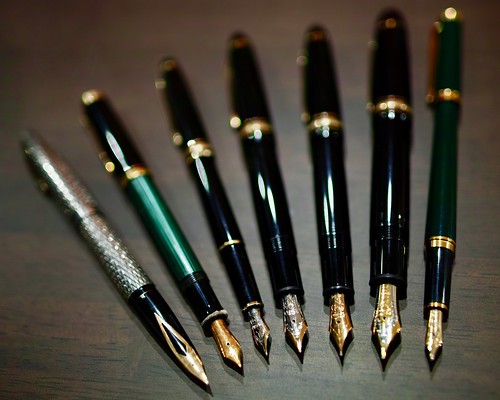
Find the location of a particular element. pens is located at coordinates (136, 283), (176, 258), (240, 254), (285, 244), (337, 238), (390, 236), (451, 240).